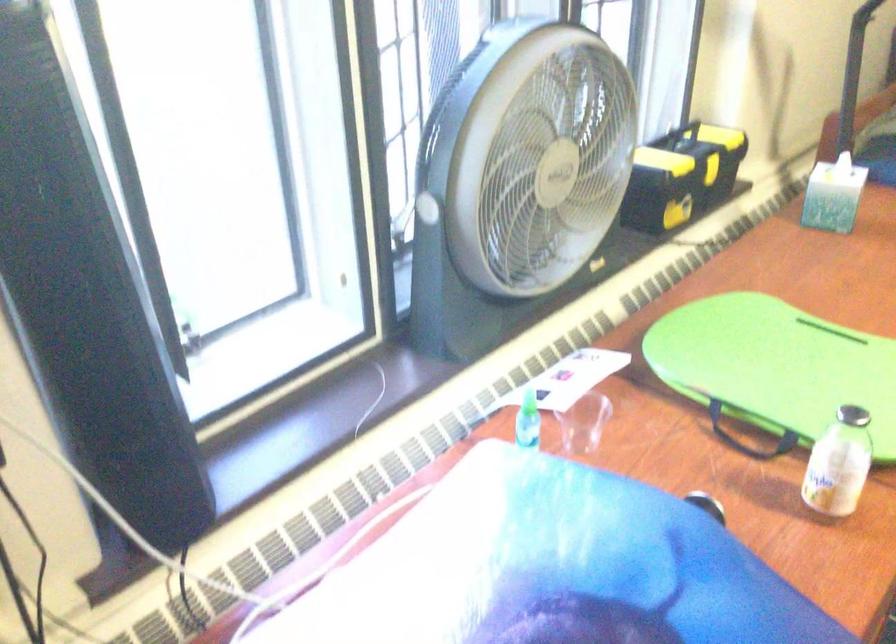
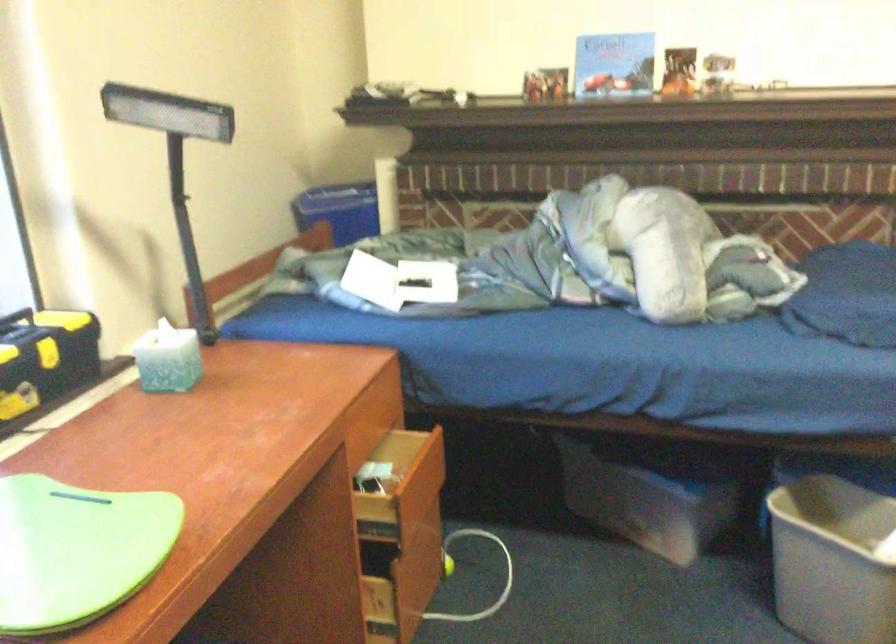
Question: Based on the continuous images, in which direction is the camera rotating? Reply with the corresponding letter.

Choices:
 (A) Left
 (B) Right
 (C) Up
 (D) Down

Answer: (B)